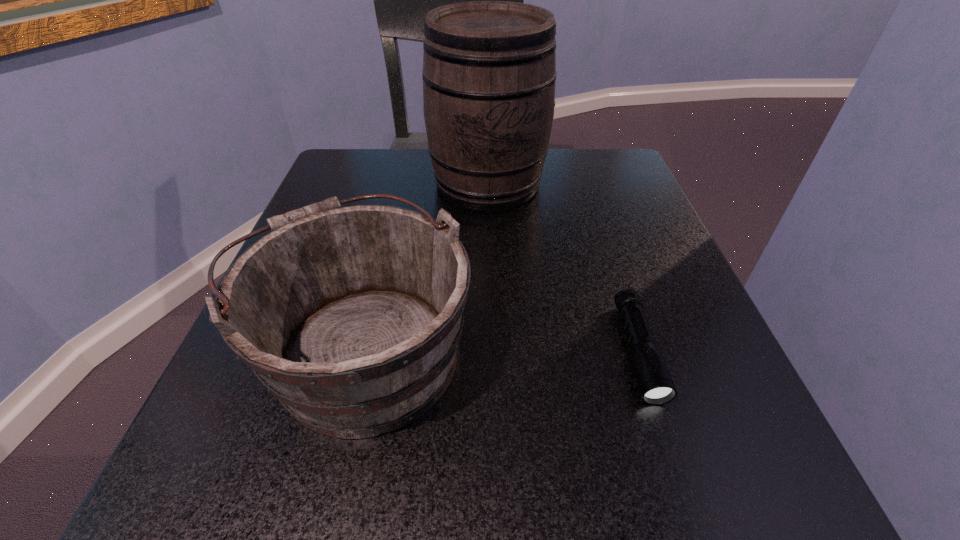
What are the coordinates of `free space between the rightmost object and the tallest object` in the screenshot? It's located at (564, 267).

Locate an element on the screen. empty space between the farthest object and the rightmost object is located at coordinates (564, 267).

Where is `free spot between the shorter wine bucket and the rightmost object`? free spot between the shorter wine bucket and the rightmost object is located at coordinates [500, 349].

This screenshot has height=540, width=960. What are the coordinates of `free space between the rightmost object and the second shortest object` in the screenshot? It's located at (500, 349).

This screenshot has height=540, width=960. I want to click on free area in between the shortest object and the tallest object, so click(564, 267).

Where is `vacant area that lies between the shorter wine bucket and the rightmost object`? The image size is (960, 540). vacant area that lies between the shorter wine bucket and the rightmost object is located at coordinates (500, 349).

What are the coordinates of `the second closest object to the nearer wine bucket` in the screenshot? It's located at (655, 383).

Locate which object ranks second in proximity to the second shortest object. Please provide its 2D coordinates. Your answer should be formatted as a tuple, i.e. [(x, y)], where the tuple contains the x and y coordinates of a point satisfying the conditions above.

[(655, 383)]

I want to click on free space that satisfies the following two spatial constraints: 1. on the back side of the shorter wine bucket; 2. on the left side of the farthest object, so click(x=403, y=183).